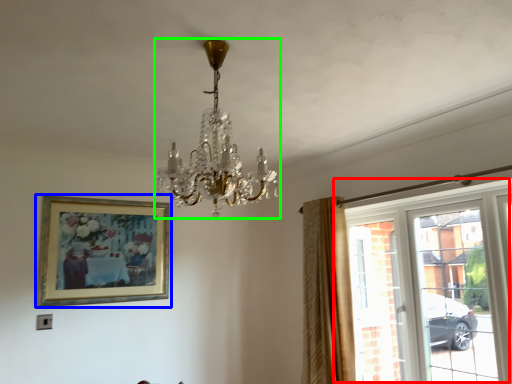
Question: Considering the real-world distances, which object is farthest from window (highlighted by a red box)? picture frame (highlighted by a blue box) or lamp (highlighted by a green box)?

Choices:
 (A) picture frame
 (B) lamp

Answer: (A)